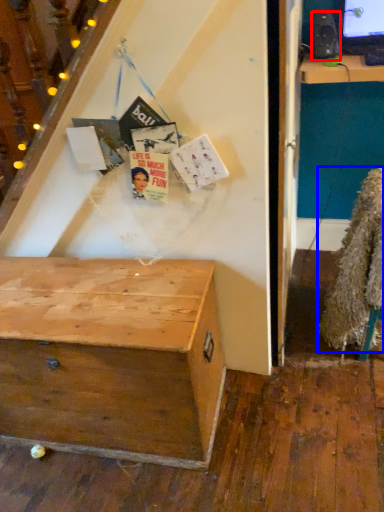
Question: Which of the following is the closest to the observer, loudspeaker (highlighted by a red box) or fur coat (highlighted by a blue box)?

Choices:
 (A) loudspeaker
 (B) fur coat

Answer: (B)